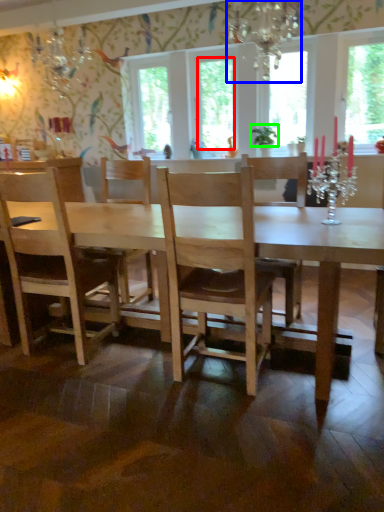
Question: Which is nearer to the window screen (highlighted by a red box)? light fixture (highlighted by a blue box) or plant (highlighted by a green box).

Choices:
 (A) light fixture
 (B) plant

Answer: (B)